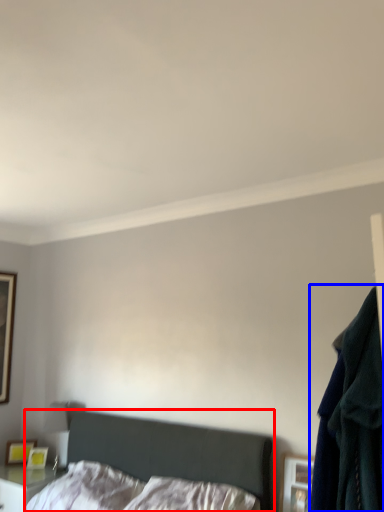
Question: Which of the following is the farthest to the observer, bed (highlighted by a red box) or clothing (highlighted by a blue box)?

Choices:
 (A) bed
 (B) clothing

Answer: (B)